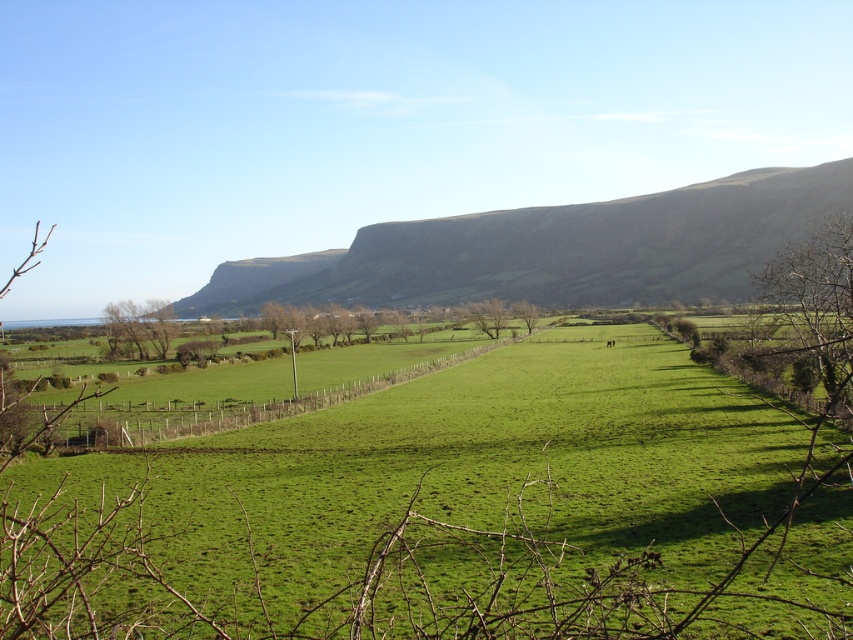
What do you see at coordinates (451, 515) in the screenshot? I see `green grassy field at center` at bounding box center [451, 515].

Does green grassy field at center appear on the left side of green leafy tree at center?

Indeed, green grassy field at center is positioned on the left side of green leafy tree at center.

I want to click on green grassy field at center, so click(451, 515).

Identify the location of green grassy field at center. The width and height of the screenshot is (853, 640). (451, 515).

Who is more distant from viewer, (160, 317) or (521, 300)?

Positioned behind is point (521, 300).

This screenshot has width=853, height=640. Describe the element at coordinates (140, 324) in the screenshot. I see `green leafy tree at lower left` at that location.

Find the location of `green leafy tree at lower left`. green leafy tree at lower left is located at coordinates (140, 324).

Does green grassy field at center appear on the left side of green leafy tree at lower left?

No, green grassy field at center is not to the left of green leafy tree at lower left.

The image size is (853, 640). Describe the element at coordinates (451, 515) in the screenshot. I see `green grassy field at center` at that location.

Describe the element at coordinates (451, 515) in the screenshot. This screenshot has height=640, width=853. I see `green grassy field at center` at that location.

What are the coordinates of `green grassy field at center` in the screenshot? It's located at (451, 515).